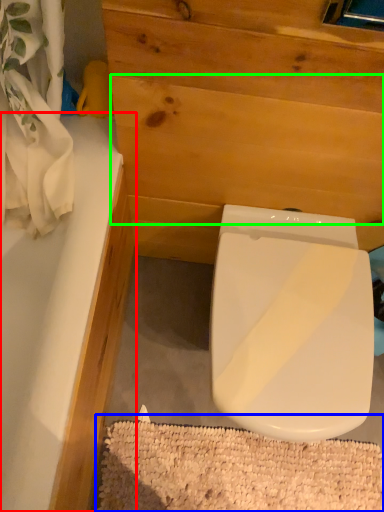
Question: Estimate the real-world distances between objects in this image. Which object is farther from bathtub (highlighted by a red box), bath mat (highlighted by a blue box) or plywood (highlighted by a green box)?

Choices:
 (A) bath mat
 (B) plywood

Answer: (A)